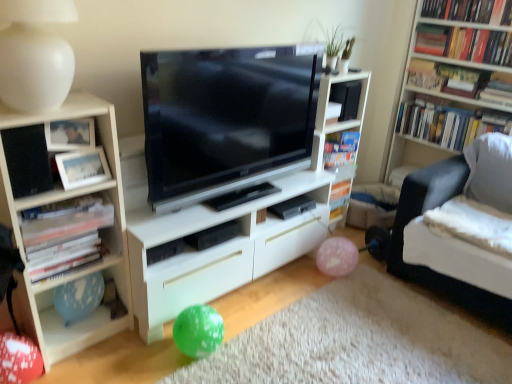
You are a GUI agent. You are given a task and a screenshot of the screen. Output one action in this format:
    pyautogui.click(x=<x>, y=<y>)
    Task: Click on the free space in front of pink dotted balloon at lower right, placed as the first balloon when sorted from top to bottom
    
    Given the screenshot: What is the action you would take?
    338,289